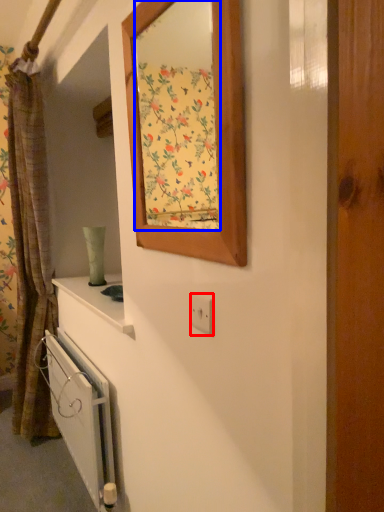
Question: Among these objects, which one is nearest to the camera, electric outlet (highlighted by a red box) or mirror (highlighted by a blue box)?

Choices:
 (A) electric outlet
 (B) mirror

Answer: (B)